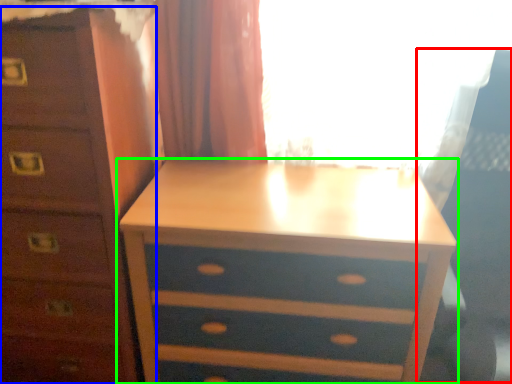
Question: Considering the real-world distances, which object is farthest from swivel chair (highlighted by a red box)? chest of drawers (highlighted by a blue box) or nightstand (highlighted by a green box)?

Choices:
 (A) chest of drawers
 (B) nightstand

Answer: (A)